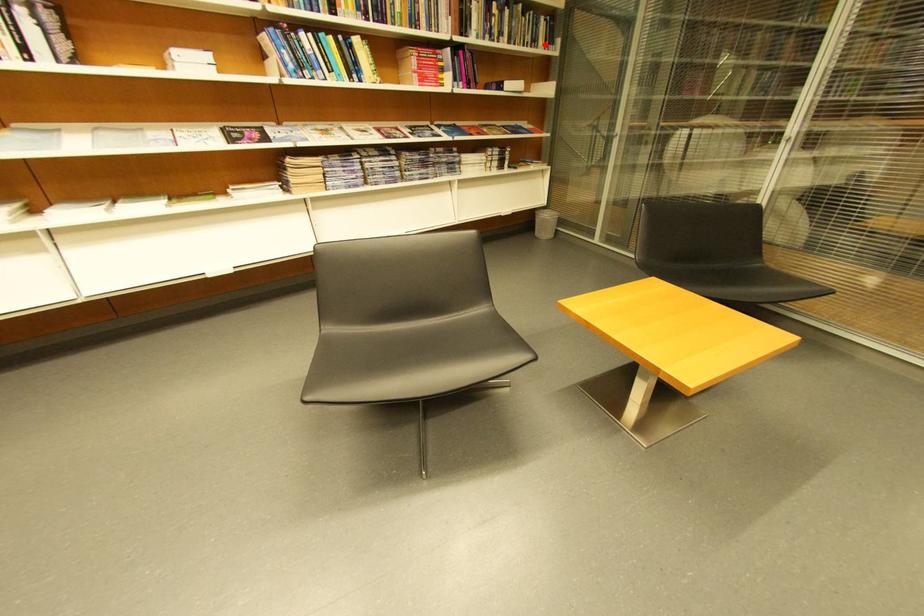
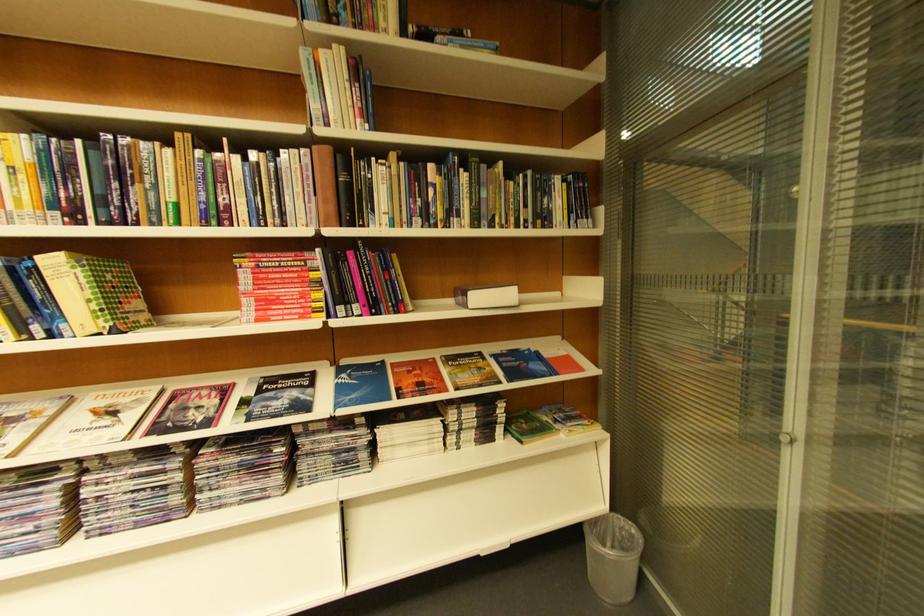
In the second image, find the point that corresponds to the highlighted location in the first image.

(554, 221)